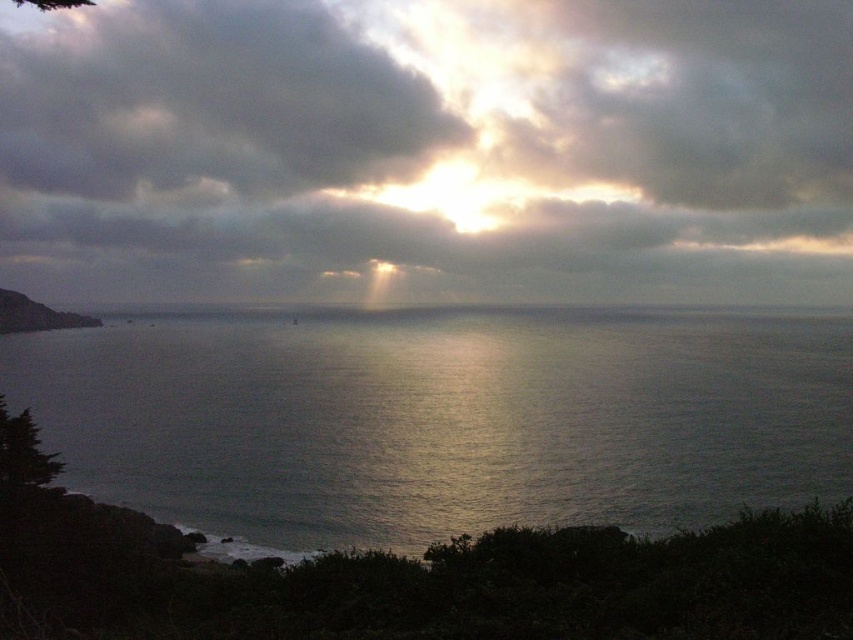
You are a photographer planning to capture the reflection of the cloudy sky at upper center on the glistening silver water at center. Based on the scene, will the reflection be clearly visible?

The cloudy sky at upper center is positioned over glistening silver water at center, so the reflection of the cloudy sky at upper center on the glistening silver water at center should be clearly visible as long as the water surface is calm enough to reflect it.

You are a photographer positioned at the origin point of the image. You want to capture a shot where the cloudy sky at upper center is centered in your viewfinder. What are the coordinates you should aim for?

The cloudy sky at upper center is located at coordinates point (428,148), so you should aim your camera at those coordinates to center it in your viewfinder.